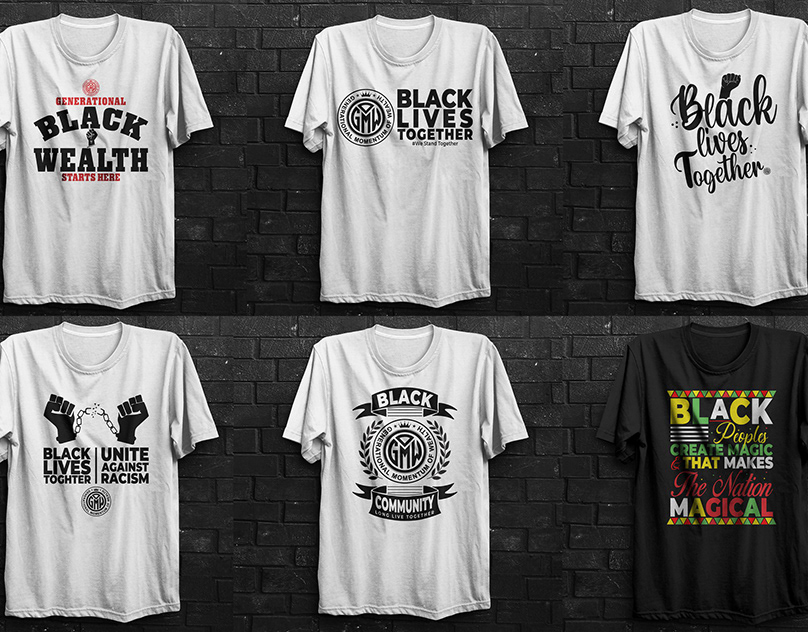
This screenshot has height=632, width=808. Identify the location of black wall area. (x=229, y=217).